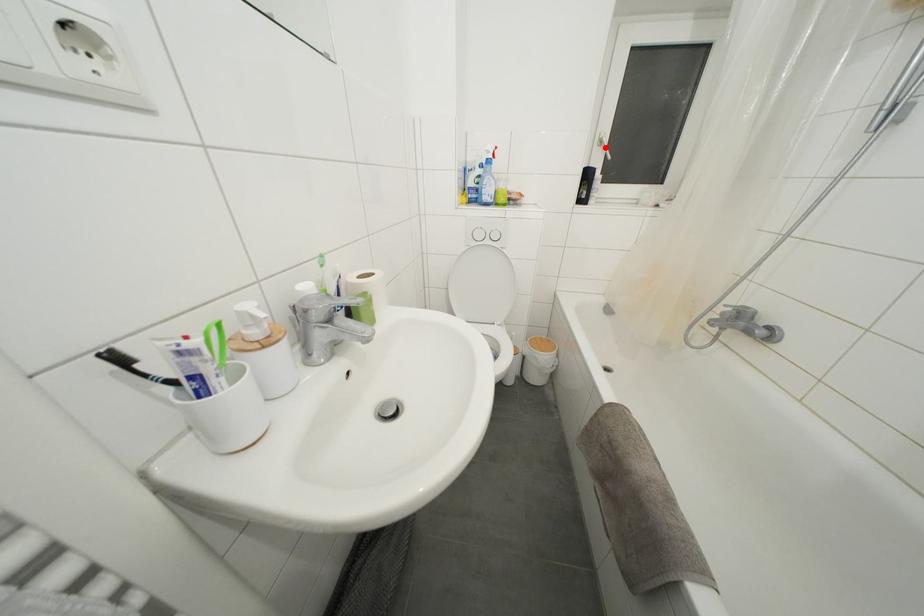
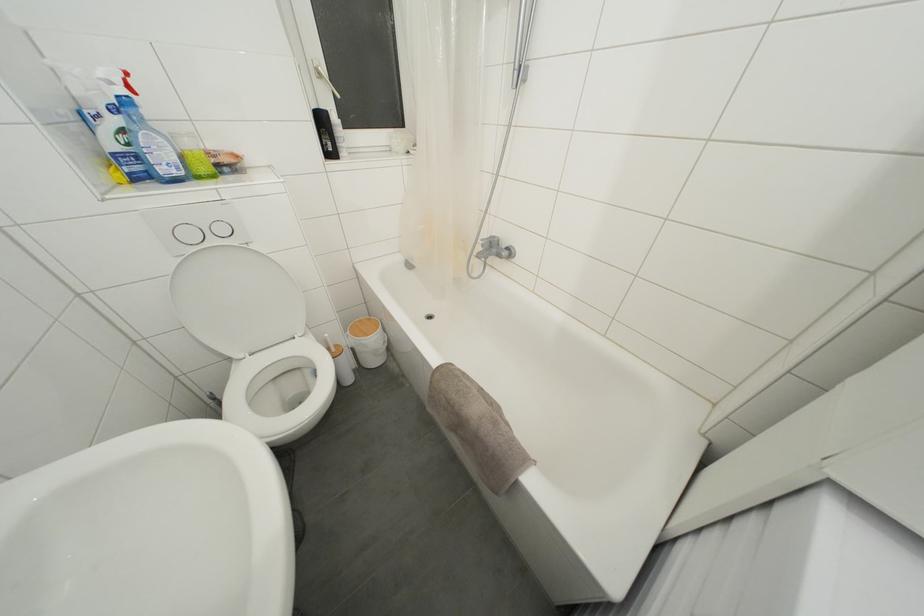
Find the pixel in the second image that matches the highlighted location in the first image.

(323, 79)